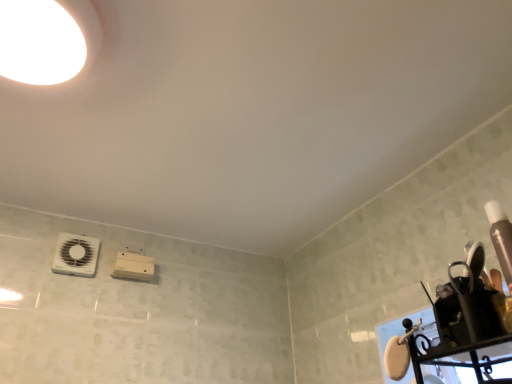
Question: From the image's perspective, is white plastic fan at lower left on top of white glossy droplight at upper left?

Choices:
 (A) yes
 (B) no

Answer: (B)

Question: Is white glossy droplight at upper left located within white plastic fan at lower left?

Choices:
 (A) yes
 (B) no

Answer: (B)

Question: Can you confirm if white plastic fan at lower left is wider than white glossy droplight at upper left?

Choices:
 (A) yes
 (B) no

Answer: (B)

Question: Considering the relative positions of white plastic fan at lower left and white glossy droplight at upper left in the image provided, is white plastic fan at lower left to the left of white glossy droplight at upper left from the viewer's perspective?

Choices:
 (A) yes
 (B) no

Answer: (A)

Question: From the image's perspective, is white plastic fan at lower left beneath white glossy droplight at upper left?

Choices:
 (A) yes
 (B) no

Answer: (A)

Question: Are white plastic fan at lower left and white glossy droplight at upper left making contact?

Choices:
 (A) no
 (B) yes

Answer: (A)

Question: From a real-world perspective, is white glossy droplight at upper left physically below white plastic fan at lower left?

Choices:
 (A) no
 (B) yes

Answer: (A)

Question: Is white glossy droplight at upper left facing towards white plastic fan at lower left?

Choices:
 (A) no
 (B) yes

Answer: (A)

Question: Is white glossy droplight at upper left next to white plastic fan at lower left?

Choices:
 (A) no
 (B) yes

Answer: (A)

Question: Is white glossy droplight at upper left smaller than white plastic fan at lower left?

Choices:
 (A) yes
 (B) no

Answer: (B)

Question: Is white glossy droplight at upper left taller than white plastic fan at lower left?

Choices:
 (A) no
 (B) yes

Answer: (A)

Question: Is white plastic fan at lower left at the back of white glossy droplight at upper left?

Choices:
 (A) yes
 (B) no

Answer: (A)

Question: Based on their positions, is white plastic fan at lower left located to the left or right of white glossy droplight at upper left?

Choices:
 (A) left
 (B) right

Answer: (A)